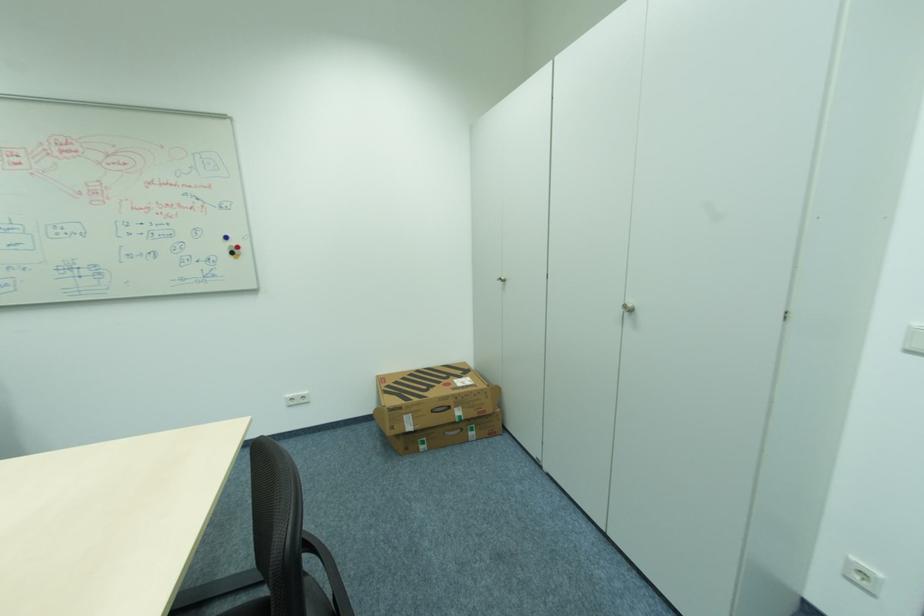
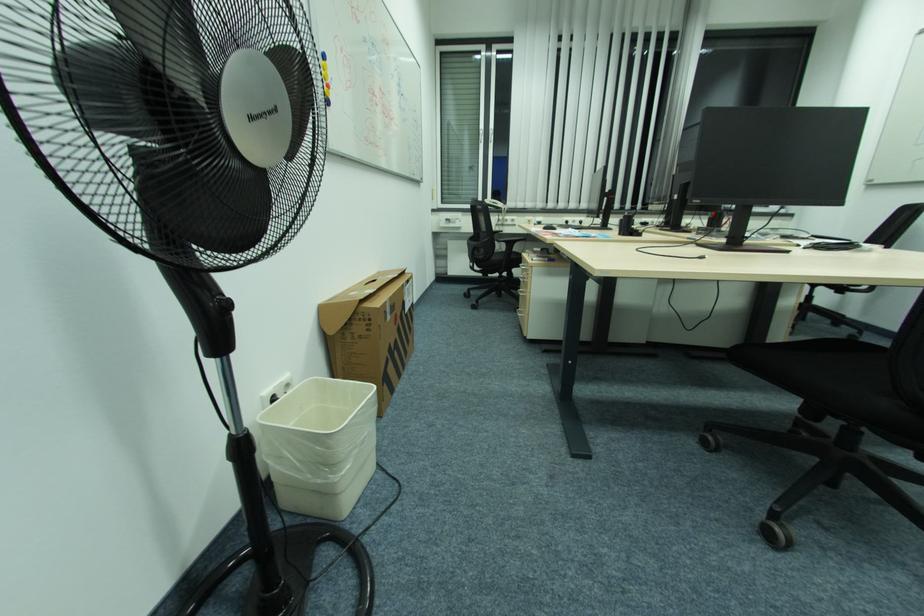
How did the camera likely rotate?

The camera rotated toward left-down.